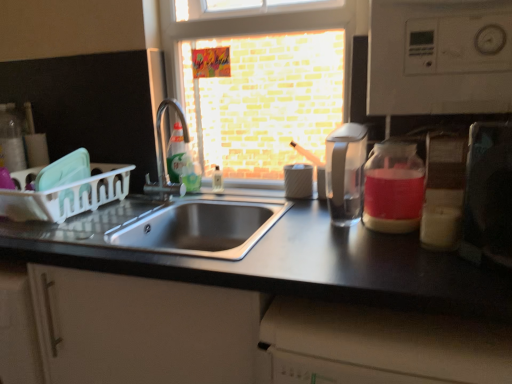
Where is `free location to the left of pink translucent glass jar at right`? Image resolution: width=512 pixels, height=384 pixels. free location to the left of pink translucent glass jar at right is located at coordinates (321, 238).